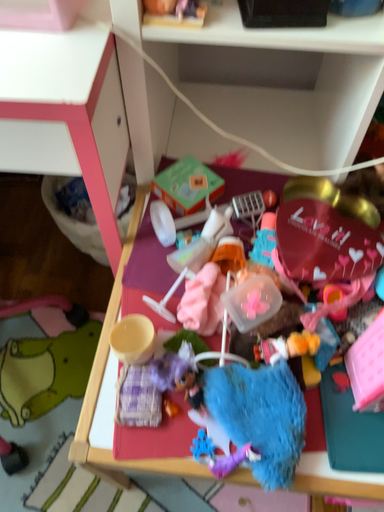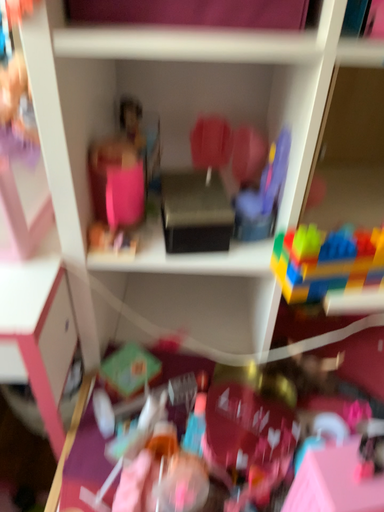
Question: How did the camera likely rotate when shooting the video?

Choices:
 (A) rotated upward
 (B) rotated downward

Answer: (A)